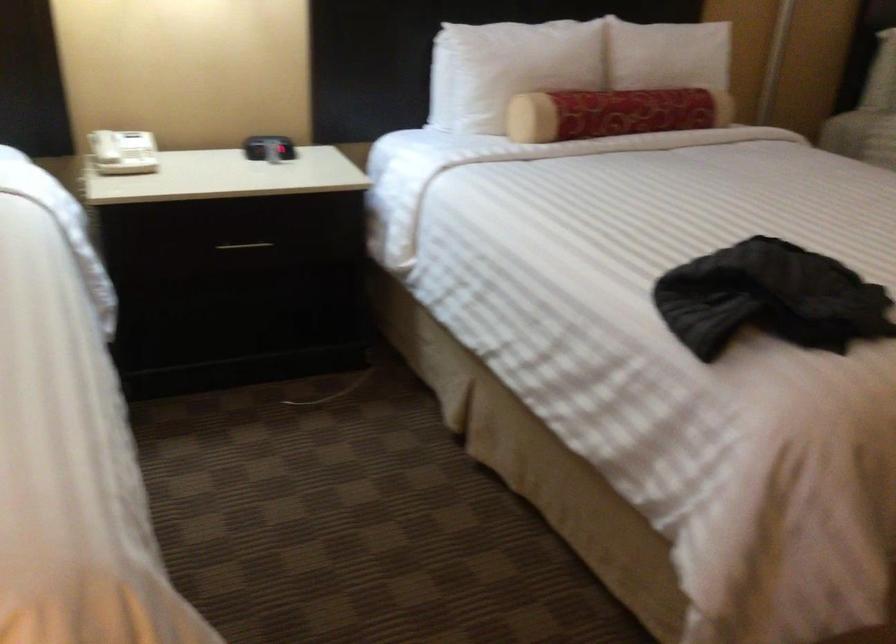
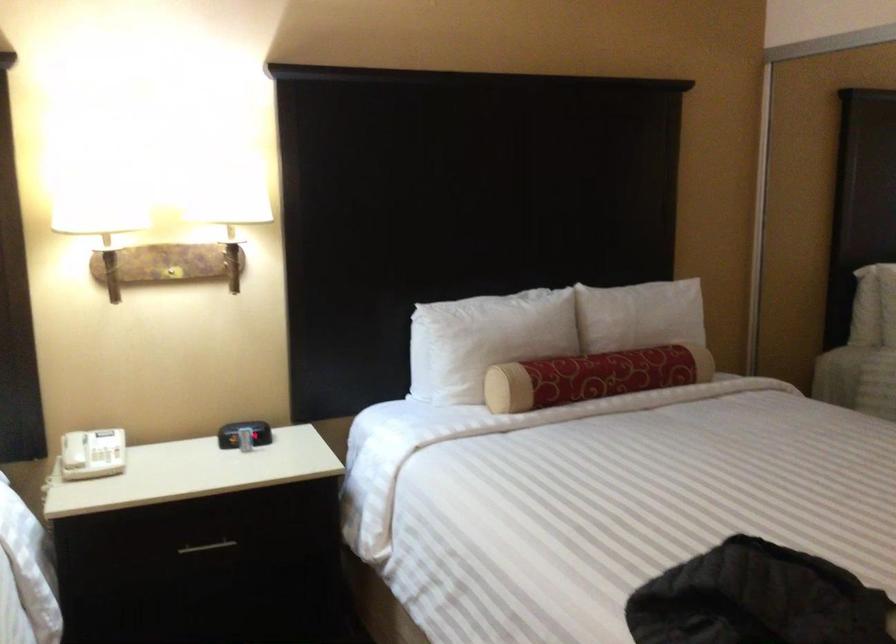
The point at (515, 67) is marked in the first image. Where is the corresponding point in the second image?

(485, 339)